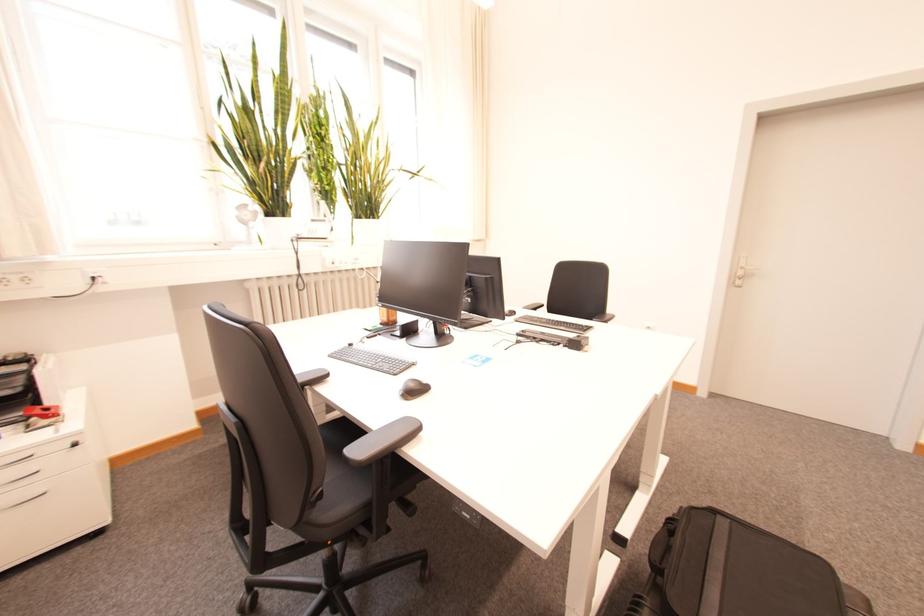
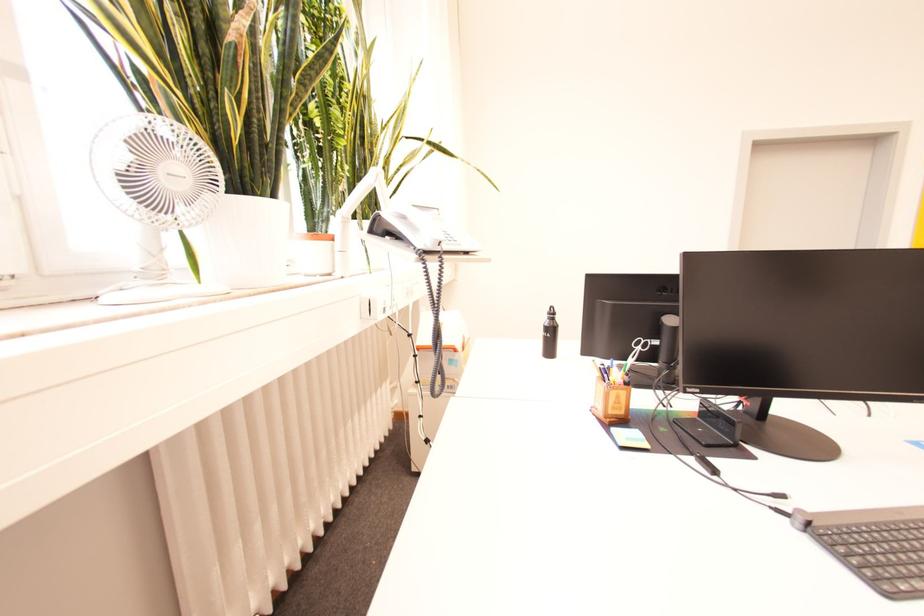
In the second image, find the point that corresponds to [390,312] in the first image.

(625, 398)